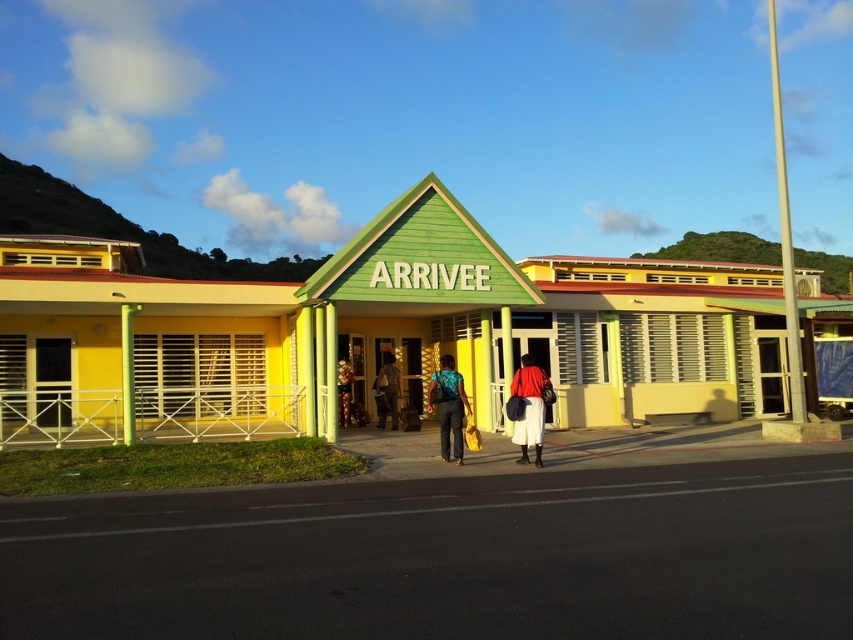
Between point (440, 385) and point (534, 406), which one is positioned in front?

Positioned in front is point (534, 406).

Image resolution: width=853 pixels, height=640 pixels. What do you see at coordinates (448, 406) in the screenshot?
I see `teal fabric backpack at center` at bounding box center [448, 406].

At what (x,y) coordinates should I click in order to perform the action: click on teal fabric backpack at center. Please return your answer as a coordinate pair (x, y). The height and width of the screenshot is (640, 853). Looking at the image, I should click on (448, 406).